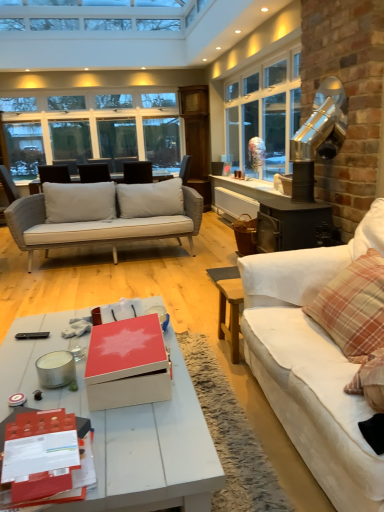
Question: From a real-world perspective, is black plastic remote control at lower left physically located above or below clear glass window at upper left?

Choices:
 (A) below
 (B) above

Answer: (A)

Question: Considering the positions of black plastic remote control at lower left and clear glass window at upper left in the image, is black plastic remote control at lower left bigger or smaller than clear glass window at upper left?

Choices:
 (A) big
 (B) small

Answer: (B)

Question: Which object is positioned closest to the white painted wood coffee table at lower center?

Choices:
 (A) clear glass window at upper left
 (B) black plastic remote control at lower left
 (C) plaid fabric pillow at right
 (D) matte red box at center
 (E) matte black chair at center

Answer: (D)

Question: Estimate the real-world distances between objects in this image. Which object is farther from the black plastic remote control at lower left?

Choices:
 (A) matte red box at center
 (B) white fabric couch at right
 (C) plaid fabric pillow at right
 (D) clear glass window at upper left
 (E) matte black chair at center

Answer: (D)